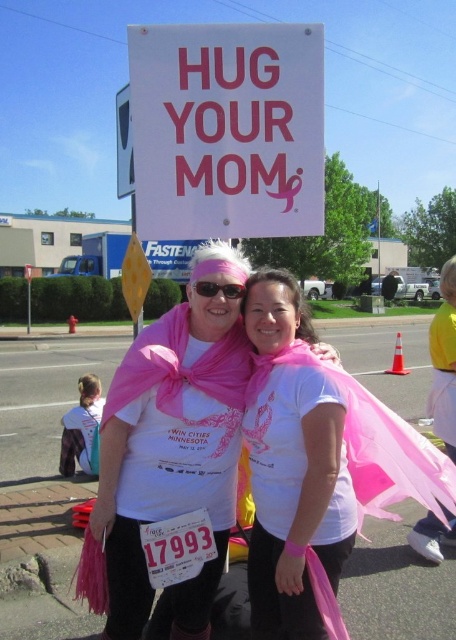
Question: Considering the real-world distances, which object is farthest from the pink fabric scarf at center?

Choices:
 (A) white matte t-shirt at center
 (B) matte black sunglasses at center

Answer: (B)

Question: Does pink fabric scarf at center appear on the right side of matte black sunglasses at center?

Choices:
 (A) no
 (B) yes

Answer: (B)

Question: Which is farther from the pink fabric scarf at center?

Choices:
 (A) white matte t-shirt at center
 (B) matte black sunglasses at center
 (C) white paper sign at upper center

Answer: (C)

Question: Is white paper sign at upper center thinner than white matte t-shirt at center?

Choices:
 (A) no
 (B) yes

Answer: (B)

Question: From the image, what is the correct spatial relationship of pink fabric scarf at center in relation to matte black sunglasses at center?

Choices:
 (A) right
 (B) left

Answer: (A)

Question: Which object appears farthest from the camera in this image?

Choices:
 (A) white paper sign at upper center
 (B) pink fabric scarf at center

Answer: (A)